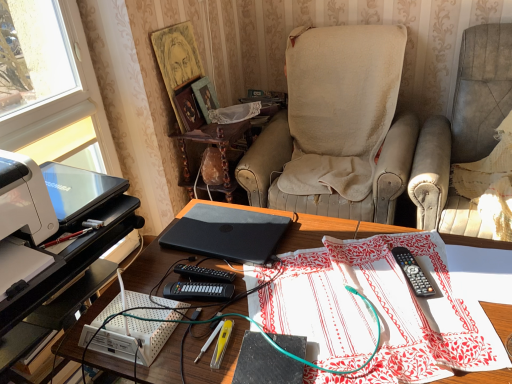
What is the approximate width of matte black laptop at left, which is counted as the 2th laptop, starting from the right?

16.05 inches.

Looking at this image, what is the approximate height of white printed fabric at center?

The height of white printed fabric at center is 2.15 inches.

How much space does black plastic keyboard at center, acting as the 2th stationery starting from the right, occupy vertically?

1.17 inches.

Find the location of `orange matte laptop at center, the first laptop from the right`. orange matte laptop at center, the first laptop from the right is located at coordinates (227, 233).

This screenshot has height=384, width=512. Identify the location of white plastic printer at left. (24, 199).

The image size is (512, 384). What do you see at coordinates (322, 228) in the screenshot? I see `matte black laptop at center` at bounding box center [322, 228].

At what (x,y) coordinates should I click in order to perform the action: click on black plastic remote control at center, acting as the 2th stationery starting from the left. Please return your answer as a coordinate pair (x, y). This screenshot has height=384, width=512. Looking at the image, I should click on (413, 273).

Is beige fabric chair at right, which is the second chair from left to right, looking in the opposite direction of orange matte laptop at center, placed as the 2th laptop when sorted from left to right?

No, beige fabric chair at right, which is the second chair from left to right,'s orientation is not away from orange matte laptop at center, placed as the 2th laptop when sorted from left to right.

Is beige fabric chair at right, which is the second chair from left to right, not within orange matte laptop at center, the first laptop from the right?

Absolutely, beige fabric chair at right, which is the second chair from left to right, is external to orange matte laptop at center, the first laptop from the right.

The width and height of the screenshot is (512, 384). What are the coordinates of `chair below the orange matte laptop at center, the first laptop from the right (from a real-world perspective)` in the screenshot? It's located at [478, 141].

How different are the orientations of beige fabric chair at right, which is the second chair from left to right, and orange matte laptop at center, the first laptop from the right, in degrees?

The angle between the facing direction of beige fabric chair at right, which is the second chair from left to right, and the facing direction of orange matte laptop at center, the first laptop from the right, is 0.73 degrees.

Does black plastic remote control at center, the 1th stationery from the right, have a lesser height compared to orange matte laptop at center, the first laptop from the right?

Incorrect, the height of black plastic remote control at center, the 1th stationery from the right, does not fall short of that of orange matte laptop at center, the first laptop from the right.

Which object is thinner, black plastic remote control at center, acting as the 2th stationery starting from the left, or orange matte laptop at center, the first laptop from the right?

black plastic remote control at center, acting as the 2th stationery starting from the left.

From a real-world perspective, is black plastic remote control at center, the 1th stationery from the right, positioned under orange matte laptop at center, the first laptop from the right, based on gravity?

Yes, from a real-world perspective, black plastic remote control at center, the 1th stationery from the right, is below orange matte laptop at center, the first laptop from the right.

Does beige fabric chair at right, the 1th chair positioned from the right, have a lesser width compared to black plastic keyboard at center, acting as the 2th stationery starting from the right?

Incorrect, the width of beige fabric chair at right, the 1th chair positioned from the right, is not less than that of black plastic keyboard at center, acting as the 2th stationery starting from the right.

How many degrees apart are the facing directions of beige fabric chair at right, the 1th chair positioned from the right, and black plastic keyboard at center, which appears as the first stationery when viewed from the left?

There is a 105-degree angle between the facing directions of beige fabric chair at right, the 1th chair positioned from the right, and black plastic keyboard at center, which appears as the first stationery when viewed from the left.

From the image's perspective, which one is positioned higher, beige fabric chair at right, which is the second chair from left to right, or black plastic keyboard at center, which appears as the first stationery when viewed from the left?

beige fabric chair at right, which is the second chair from left to right, appears higher in the image.

Considering the sizes of objects matte black laptop at left, which is counted as the 2th laptop, starting from the right, and black plastic keyboard at center, which appears as the first stationery when viewed from the left, in the image provided, who is wider, matte black laptop at left, which is counted as the 2th laptop, starting from the right, or black plastic keyboard at center, which appears as the first stationery when viewed from the left,?

matte black laptop at left, which is counted as the 2th laptop, starting from the right, is wider.

Where is `laptop that is the 2nd object above the black plastic keyboard at center, acting as the 2th stationery starting from the right (from a real-world perspective)`? The image size is (512, 384). laptop that is the 2nd object above the black plastic keyboard at center, acting as the 2th stationery starting from the right (from a real-world perspective) is located at coordinates (78, 190).

Between matte black laptop at left, arranged as the 1th laptop when viewed from the left, and black plastic keyboard at center, acting as the 2th stationery starting from the right, which one appears on the right side from the viewer's perspective?

black plastic keyboard at center, acting as the 2th stationery starting from the right.

Is matte black laptop at left, arranged as the 1th laptop when viewed from the left, directly adjacent to black plastic keyboard at center, acting as the 2th stationery starting from the right?

matte black laptop at left, arranged as the 1th laptop when viewed from the left, and black plastic keyboard at center, acting as the 2th stationery starting from the right, are clearly separated.

Can matte black laptop at center be found inside white plastic printer at left?

No, matte black laptop at center is located outside of white plastic printer at left.

Is white plastic printer at left in contact with matte black laptop at center?

No, white plastic printer at left is not beside matte black laptop at center.

From the image's perspective, is white plastic printer at left above matte black laptop at center?

Yes, from the image's perspective, white plastic printer at left is above matte black laptop at center.

Considering the relative sizes of white plastic printer at left and matte black laptop at center in the image provided, is white plastic printer at left thinner than matte black laptop at center?

Indeed, white plastic printer at left has a lesser width compared to matte black laptop at center.

From a real-world perspective, is matte black laptop at left, arranged as the 1th laptop when viewed from the left, located beneath beige fabric chair at center, acting as the first chair starting from the left?

No, from a real-world perspective, matte black laptop at left, arranged as the 1th laptop when viewed from the left, is not beneath beige fabric chair at center, acting as the first chair starting from the left.

Could you tell me if matte black laptop at left, arranged as the 1th laptop when viewed from the left, is turned towards beige fabric chair at center, acting as the first chair starting from the left?

No, matte black laptop at left, arranged as the 1th laptop when viewed from the left, is not facing towards beige fabric chair at center, acting as the first chair starting from the left.

Considering their positions, is matte black laptop at left, which is counted as the 2th laptop, starting from the right, located in front of or behind beige fabric chair at center, acting as the first chair starting from the left?

Clearly, matte black laptop at left, which is counted as the 2th laptop, starting from the right, is in front of beige fabric chair at center, acting as the first chair starting from the left.

Is matte black laptop at center bigger than orange matte laptop at center, placed as the 2th laptop when sorted from left to right?

Indeed, matte black laptop at center has a larger size compared to orange matte laptop at center, placed as the 2th laptop when sorted from left to right.

Is matte black laptop at center oriented away from orange matte laptop at center, placed as the 2th laptop when sorted from left to right?

No, orange matte laptop at center, placed as the 2th laptop when sorted from left to right, is not at the back of matte black laptop at center.

Is matte black laptop at center beside orange matte laptop at center, placed as the 2th laptop when sorted from left to right?

matte black laptop at center and orange matte laptop at center, placed as the 2th laptop when sorted from left to right, are not in contact.

Can you confirm if matte black laptop at center is shorter than orange matte laptop at center, the first laptop from the right?

In fact, matte black laptop at center may be taller than orange matte laptop at center, the first laptop from the right.

You are a GUI agent. You are given a task and a screenshot of the screen. Output one action in this format:
    pyautogui.click(x=<x>, y=<y>)
    Task: Click on the chair that is the 1st object located behind the orange matte laptop at center, placed as the 2th laptop when sorted from left to right
    
    Given the screenshot: What is the action you would take?
    pyautogui.click(x=478, y=141)

From a real-world perspective, which stationery is the 1st one underneath the orange matte laptop at center, the first laptop from the right? Please provide its 2D coordinates.

[(413, 273)]

Which object lies further to the anchor point beige fabric chair at right, which is the second chair from left to right, white plastic printer at left or matte black laptop at center?

white plastic printer at left lies further to beige fabric chair at right, which is the second chair from left to right, than the other object.

From the image, which object appears to be farther from black plastic keyboard at center, acting as the 2th stationery starting from the right, matte black laptop at center or wooden polished side table at center?

The object further to black plastic keyboard at center, acting as the 2th stationery starting from the right, is wooden polished side table at center.

Looking at the image, which one is located closer to black plastic keyboard at center, acting as the 2th stationery starting from the right, matte black laptop at center or white printed fabric at center?

Based on the image, matte black laptop at center appears to be nearer to black plastic keyboard at center, acting as the 2th stationery starting from the right.

From the image, which object appears to be nearer to white plastic printer at left, orange matte laptop at center, the first laptop from the right, or black plastic keyboard at center, acting as the 2th stationery starting from the right?

black plastic keyboard at center, acting as the 2th stationery starting from the right, lies closer to white plastic printer at left than the other object.

Looking at the image, which one is located closer to beige fabric chair at center, the 2th chair viewed from the right, white plastic printer at left or matte black laptop at left, arranged as the 1th laptop when viewed from the left?

matte black laptop at left, arranged as the 1th laptop when viewed from the left, is closer to beige fabric chair at center, the 2th chair viewed from the right.

Estimate the real-world distances between objects in this image. Which object is further from beige fabric chair at center, acting as the first chair starting from the left, orange matte laptop at center, the first laptop from the right, or white printed fabric at center?

white printed fabric at center is positioned further to the anchor beige fabric chair at center, acting as the first chair starting from the left.

Estimate the real-world distances between objects in this image. Which object is further from black plastic keyboard at center, which appears as the first stationery when viewed from the left, wooden polished side table at center or matte black laptop at left, arranged as the 1th laptop when viewed from the left?

Among the two, wooden polished side table at center is located further to black plastic keyboard at center, which appears as the first stationery when viewed from the left.

From the image, which object appears to be nearer to white plastic printer at left, wooden polished side table at center or beige fabric chair at center, acting as the first chair starting from the left?

Among the two, wooden polished side table at center is located nearer to white plastic printer at left.

Find the location of a particular element. This screenshot has width=512, height=384. tablecloth between matte black laptop at center and beige fabric chair at right, which is the second chair from left to right, from left to right is located at coordinates (379, 313).

You are a GUI agent. You are given a task and a screenshot of the screen. Output one action in this format:
    pyautogui.click(x=<x>, y=<y>)
    Task: Click on the laptop situated between matte black laptop at left, which is counted as the 2th laptop, starting from the right, and beige fabric chair at right, the 1th chair positioned from the right, from left to right
    The height and width of the screenshot is (384, 512).
    Given the screenshot: What is the action you would take?
    pyautogui.click(x=227, y=233)

Find the location of `tablecloth between matte black laptop at center and black plastic keyboard at center, which appears as the first stationery when viewed from the left, from front to back`. tablecloth between matte black laptop at center and black plastic keyboard at center, which appears as the first stationery when viewed from the left, from front to back is located at coordinates (379, 313).

Locate an element on the screen. The height and width of the screenshot is (384, 512). tablecloth between matte black laptop at center and black plastic remote control at center, acting as the 2th stationery starting from the left, along the z-axis is located at coordinates (379, 313).